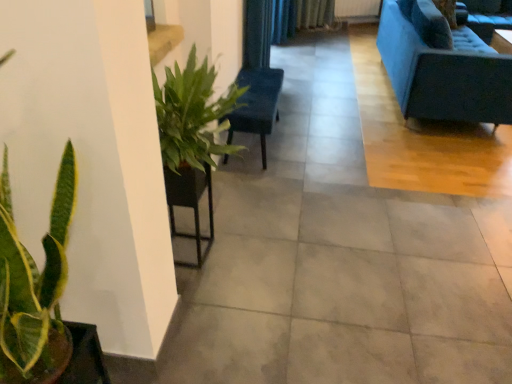
Question: From the image's perspective, is matte brown flowerpot at lower left over green glossy plant at lower left?

Choices:
 (A) yes
 (B) no

Answer: (B)

Question: Can you confirm if matte brown flowerpot at lower left is taller than green glossy plant at lower left?

Choices:
 (A) yes
 (B) no

Answer: (B)

Question: Could you tell me if matte brown flowerpot at lower left is facing green glossy plant at lower left?

Choices:
 (A) yes
 (B) no

Answer: (B)

Question: Is matte brown flowerpot at lower left not near green glossy plant at lower left?

Choices:
 (A) no
 (B) yes

Answer: (A)

Question: Does matte brown flowerpot at lower left have a lesser height compared to green glossy plant at lower left?

Choices:
 (A) yes
 (B) no

Answer: (A)

Question: From a real-world perspective, is velvet blue couch at upper right positioned above or below velvet dark blue armchair at center?

Choices:
 (A) below
 (B) above

Answer: (B)

Question: Looking at their shapes, would you say velvet blue couch at upper right is wider or thinner than velvet dark blue armchair at center?

Choices:
 (A) thin
 (B) wide

Answer: (B)

Question: In the image, is velvet blue couch at upper right on the left side or the right side of velvet dark blue armchair at center?

Choices:
 (A) left
 (B) right

Answer: (B)

Question: From the image's perspective, is velvet blue couch at upper right located above or below velvet dark blue armchair at center?

Choices:
 (A) above
 (B) below

Answer: (A)

Question: Relative to green glossy plant at lower left, is velvet dark blue armchair at center in front or behind?

Choices:
 (A) behind
 (B) front

Answer: (A)

Question: Is velvet dark blue armchair at center situated inside green glossy plant at lower left or outside?

Choices:
 (A) inside
 (B) outside

Answer: (B)

Question: Considering the positions of velvet dark blue armchair at center and green glossy plant at lower left in the image, is velvet dark blue armchair at center bigger or smaller than green glossy plant at lower left?

Choices:
 (A) big
 (B) small

Answer: (A)

Question: Would you say velvet dark blue armchair at center is to the left or to the right of green glossy plant at lower left in the picture?

Choices:
 (A) left
 (B) right

Answer: (B)

Question: Is velvet blue couch at upper right wider or thinner than matte brown flowerpot at lower left?

Choices:
 (A) wide
 (B) thin

Answer: (A)

Question: From the image's perspective, relative to matte brown flowerpot at lower left, is velvet blue couch at upper right above or below?

Choices:
 (A) above
 (B) below

Answer: (A)